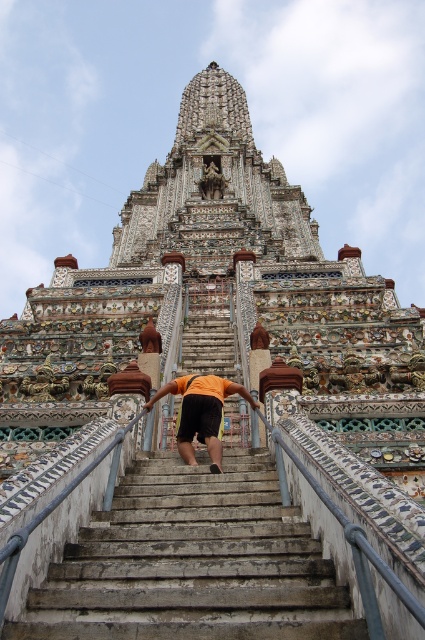
Which of these two, white stone stairs at center or orange fabric at center, stands taller?

With more height is orange fabric at center.

Identify the location of white stone stairs at center. The height and width of the screenshot is (640, 425). (192, 563).